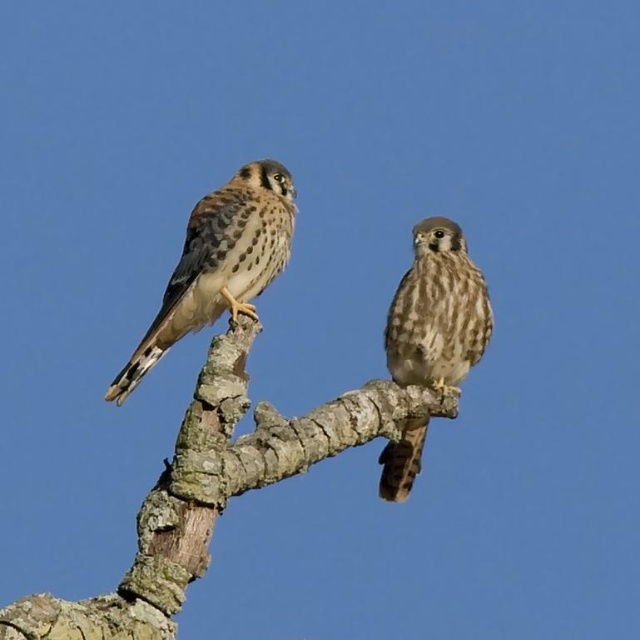
In the scene shown: Can you confirm if brown rough tree branch at center is smaller than brown speckled feathers at center?

Incorrect, brown rough tree branch at center is not smaller in size than brown speckled feathers at center.

Can you confirm if brown rough tree branch at center is positioned below brown speckled feathers at center?

Yes.

The image size is (640, 640). What are the coordinates of `brown rough tree branch at center` in the screenshot? It's located at (216, 490).

Identify the location of brown rough tree branch at center. (216, 490).

Can you confirm if brown rough tree branch at center is positioned above brown speckled feathers at left?

Actually, brown rough tree branch at center is below brown speckled feathers at left.

Can you confirm if brown rough tree branch at center is taller than brown speckled feathers at left?

Yes, brown rough tree branch at center is taller than brown speckled feathers at left.

Is point (216, 461) positioned before point (273, 243)?

Yes, it is in front of point (273, 243).

Find the location of a particular element. This screenshot has width=640, height=640. brown rough tree branch at center is located at coordinates (216, 490).

Does brown speckled feathers at left lie behind brown speckled feathers at center?

No, it is in front of brown speckled feathers at center.

Does brown speckled feathers at left have a greater height compared to brown speckled feathers at center?

No, brown speckled feathers at left is not taller than brown speckled feathers at center.

Identify the location of brown speckled feathers at left. (220, 262).